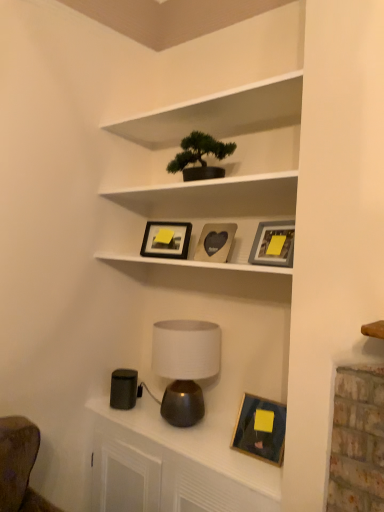
You are a GUI agent. You are given a task and a screenshot of the screen. Output one action in this format:
    pyautogui.click(x=<x>, y=<y>)
    Task: Click on the free space that is in between matte brown table lamp at center and wooden picture frame at lower right, positioned as the 1th picture frame in bottom-to-top order
    The width and height of the screenshot is (384, 512).
    Given the screenshot: What is the action you would take?
    pos(215,449)